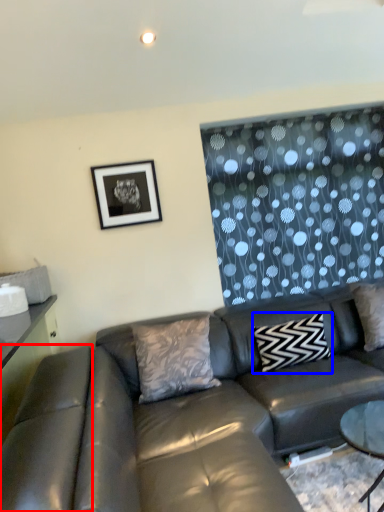
Question: Which of the following is the farthest to the observer, swivel chair (highlighted by a red box) or pillow (highlighted by a blue box)?

Choices:
 (A) swivel chair
 (B) pillow

Answer: (B)